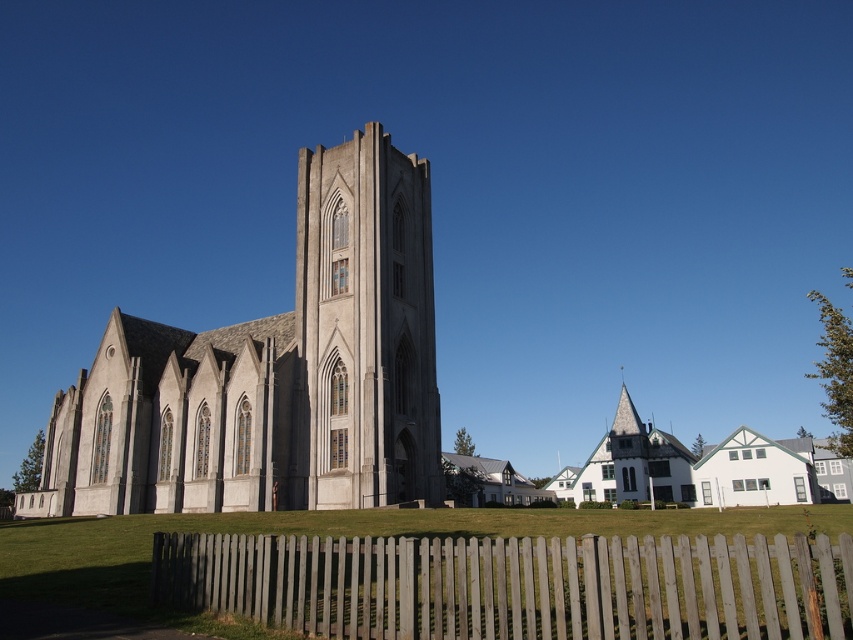
You are standing in front of the church and want to take a photo of both the gray stone church at center and the smooth concrete tower at center. Which object should you position to your left side to include both in the frame?

You should position the gray stone church at center to your left side because it is already located to the left of the smooth concrete tower at center, so aligning yourself accordingly will ensure both are in the frame.

You are standing in front of the historic church and want to take a photo. There are two points marked on your camera screen at coordinates point (422, 296) and point (650, 474). Which point is closer to your current position?

Point (422, 296) is closer to the camera than point (650, 474), so the point at coordinates point (422, 296) is closer to your current position.

Consider the image. You are standing in front of the gray stone church at center and the smooth concrete tower at center. Which structure is closer to you?

The gray stone church at center is closer to you than the smooth concrete tower at center.